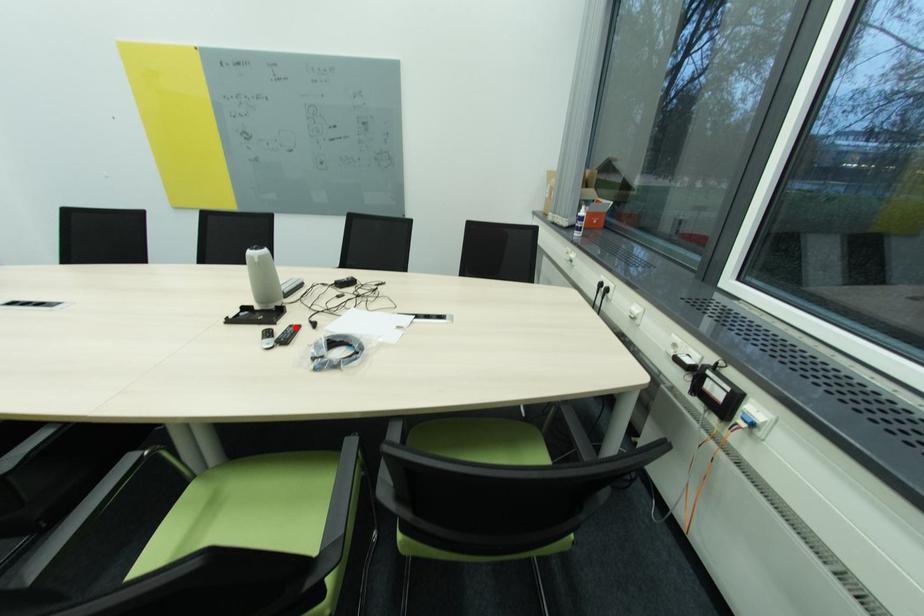
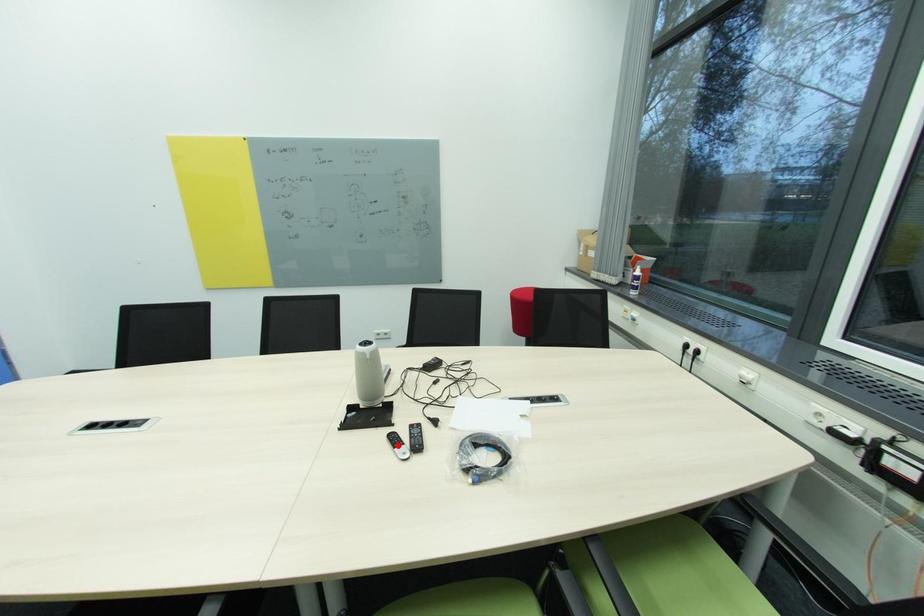
I am providing you with two images of the same scene from different viewpoints. A red point is marked on the first image and another point is marked on the second image. Are the points marked in image1 and image2 representing the same 3D position?

No